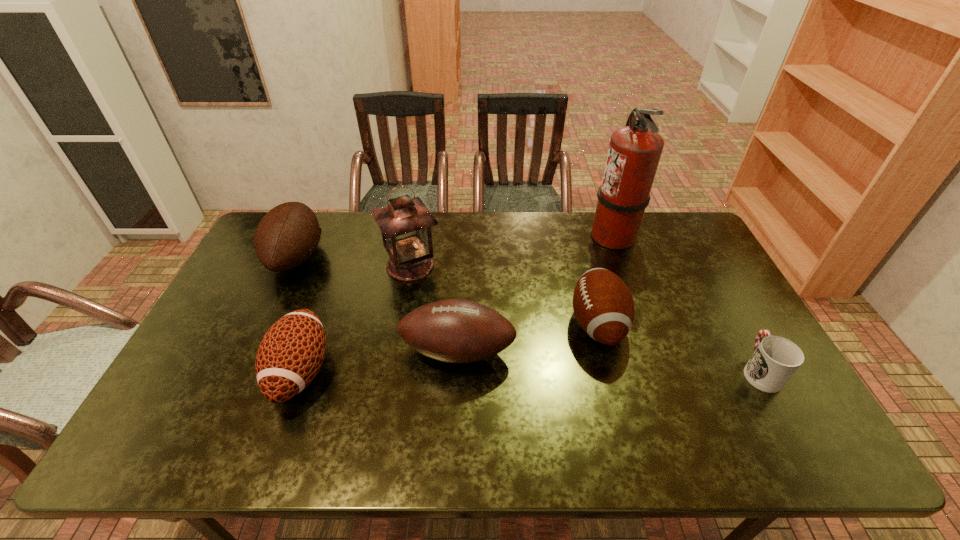
The image size is (960, 540). Identify the location of fire extinguisher. (634, 152).

Image resolution: width=960 pixels, height=540 pixels. Find the location of `the sixth shortest object`. the sixth shortest object is located at coordinates (405, 224).

You are a GUI agent. You are given a task and a screenshot of the screen. Output one action in this format:
    pyautogui.click(x=<x>, y=<y>)
    Task: Click on the second football from right to left
    
    Given the screenshot: What is the action you would take?
    pyautogui.click(x=454, y=330)

Locate an element on the screen. the rightmost football is located at coordinates (x=602, y=303).

In order to click on cup in this screenshot , I will do `click(775, 359)`.

Find the location of a particular element. This screenshot has width=960, height=540. the rightmost object is located at coordinates pos(775,359).

Locate an element on the screen. free space located toward the nozzle of the fire extinguisher is located at coordinates (550, 235).

I want to click on vacant space located toward the nozzle of the fire extinguisher, so click(503, 235).

Where is `vacant space located toward the nozzle of the fire extinguisher`? The width and height of the screenshot is (960, 540). vacant space located toward the nozzle of the fire extinguisher is located at coordinates (540, 235).

Locate an element on the screen. Image resolution: width=960 pixels, height=540 pixels. vacant position located on the right of the sixth shortest object is located at coordinates (465, 266).